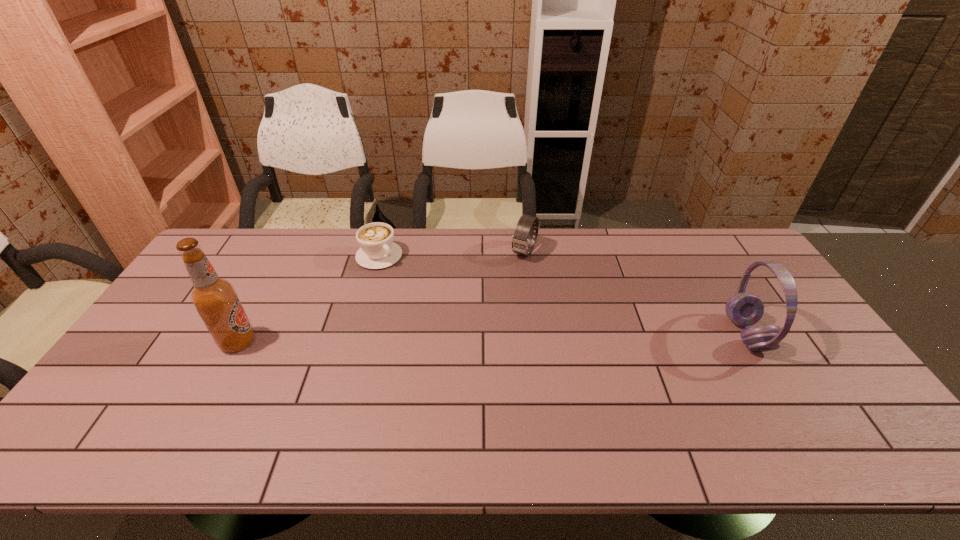
The image size is (960, 540). Identify the location of object present at the right edge. (744, 309).

In the image, there is a desktop. In order to click on vacant space at the far edge in this screenshot , I will do `click(473, 265)`.

The image size is (960, 540). I want to click on blank area at the near edge, so click(204, 390).

Identify the location of blank space at the left edge of the desktop. The height and width of the screenshot is (540, 960). (152, 360).

Find the location of a particular element. vacant space at the right edge is located at coordinates (752, 288).

Locate an element on the screen. vacant space at the far left corner is located at coordinates (234, 260).

This screenshot has height=540, width=960. Identify the location of free location at the far right corner. (699, 245).

Locate an element on the screen. free space between the third tallest object and the leftmost object is located at coordinates (381, 297).

Image resolution: width=960 pixels, height=540 pixels. Identify the location of free space between the tallest object and the watch. (381, 297).

I want to click on free space between the tallest object and the second shortest object, so click(x=381, y=297).